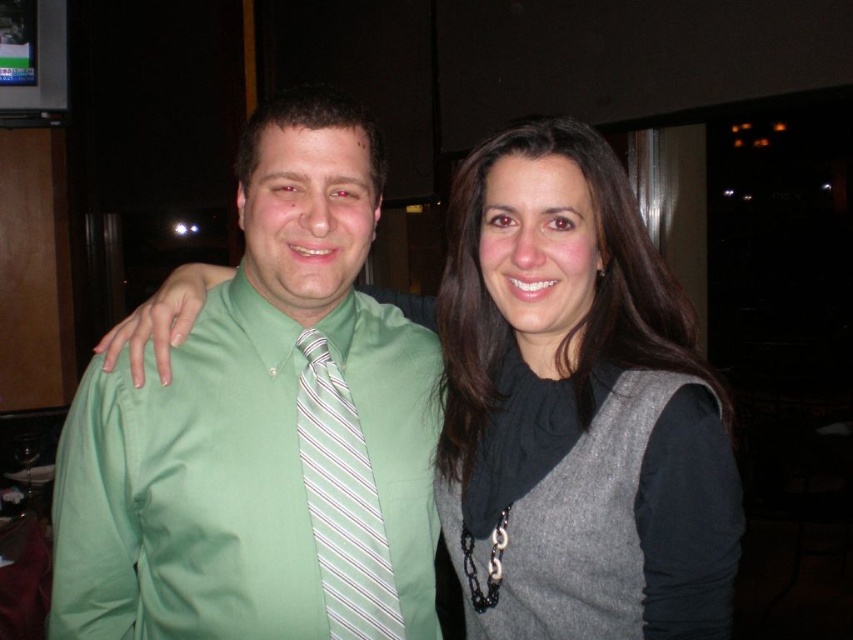
Which of these two, green smooth shirt at center or gray wool vest at right, stands taller?

With more height is green smooth shirt at center.

Who is higher up, green smooth shirt at center or gray wool vest at right?

green smooth shirt at center is above.

Is point (238, 362) positioned behind point (553, 438)?

Yes, it is behind point (553, 438).

Locate an element on the screen. This screenshot has height=640, width=853. green smooth shirt at center is located at coordinates [x=264, y=429].

Is point (669, 547) farther from viewer compared to point (370, 554)?

No.

Does gray wool vest at right appear on the left side of white striped tie at center?

In fact, gray wool vest at right is to the right of white striped tie at center.

The width and height of the screenshot is (853, 640). Describe the element at coordinates (601, 512) in the screenshot. I see `gray wool vest at right` at that location.

The width and height of the screenshot is (853, 640). In order to click on gray wool vest at right in this screenshot , I will do `click(601, 512)`.

Is green smooth shirt at center smaller than white striped tie at center?

Actually, green smooth shirt at center might be larger than white striped tie at center.

Does green smooth shirt at center appear over white striped tie at center?

Yes.

This screenshot has width=853, height=640. What do you see at coordinates (264, 429) in the screenshot? I see `green smooth shirt at center` at bounding box center [264, 429].

You are a GUI agent. You are given a task and a screenshot of the screen. Output one action in this format:
    pyautogui.click(x=<x>, y=<y>)
    Task: Click on the green smooth shirt at center
    
    Given the screenshot: What is the action you would take?
    pyautogui.click(x=264, y=429)